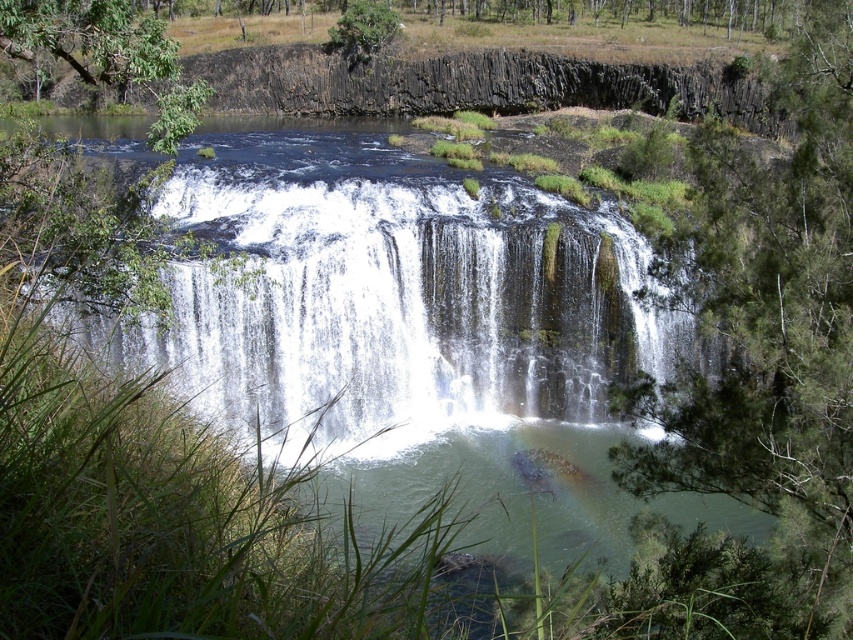
You are a hiker who wants to take a photo of both the green leafy tree at center and the green leafy tree at upper left in the same frame. Given that your camera has a maximum zoom range of 5 meters, can you capture both trees in a single photo without moving your position?

The green leafy tree at center is 8.76 meters away from the green leafy tree at upper left. Since the distance between them exceeds the camera maximum zoom range of 5 meters, you cannot capture both trees in a single photo without moving your position.

You are standing at the point with coordinates [399,307] in the image. Based on the scene description, what would you most likely see around you?

You are standing at the point corresponding to the white textured waterfall at center, so you would most likely see the waterfall cascading down the rocky cliff into the pool below, surrounded by lush greenery including tall grasses and various trees.